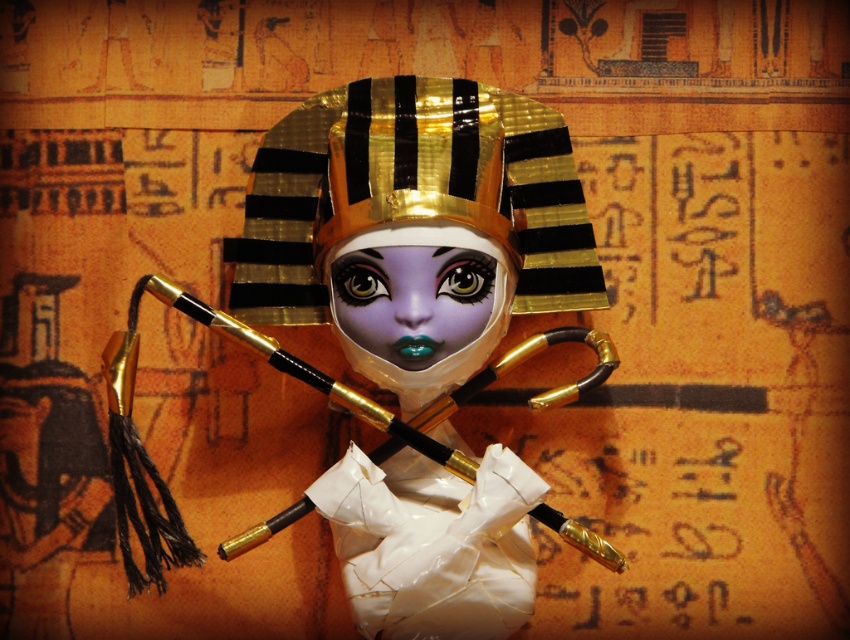
You are a photographer standing 5 feet away from the pharaoh figure. You want to take a closeup of the shiny purple eye at center. Can you get close enough to fill your camera frame with the eye without moving the figure? Explain your reasoning.

The shiny purple eye at center is 3.96 feet away from the camera. Since you are standing 5 feet away from the pharaoh figure, you are farther than the required distance. To capture a closeup, you would need to move closer to within 3.96 feet or use a zoom lens to fill the frame with the eye.